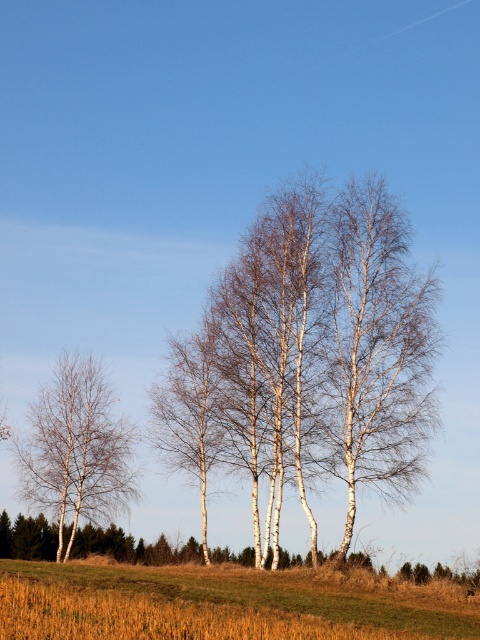
Question: Does brown grass at lower center have a larger size compared to white bark birch tree at center?

Choices:
 (A) no
 (B) yes

Answer: (B)

Question: Does brown grass at lower center appear over white bark birch tree at center?

Choices:
 (A) yes
 (B) no

Answer: (B)

Question: Which of the following is the closest to the observer?

Choices:
 (A) (379, 209)
 (B) (47, 456)
 (C) (85, 611)

Answer: (C)

Question: Does white bark birch tree at center have a lesser width compared to white smooth tree at left?

Choices:
 (A) yes
 (B) no

Answer: (B)

Question: Which of these objects is positioned closest to the white smooth tree at left?

Choices:
 (A) white bark birch tree at center
 (B) brown grass at lower center

Answer: (A)

Question: Which point is farther to the camera?

Choices:
 (A) white smooth tree at left
 (B) white bark birch tree at center

Answer: (A)